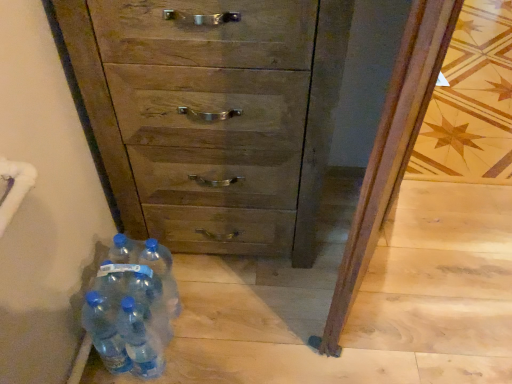
You are a GUI agent. You are given a task and a screenshot of the screen. Output one action in this format:
    pyautogui.click(x=<x>, y=<y>)
    Task: Click on the free point to the right of transparent plastic bottles at lower left, the fourth bottle viewed from the left
    
    Given the screenshot: What is the action you would take?
    pyautogui.click(x=215, y=334)